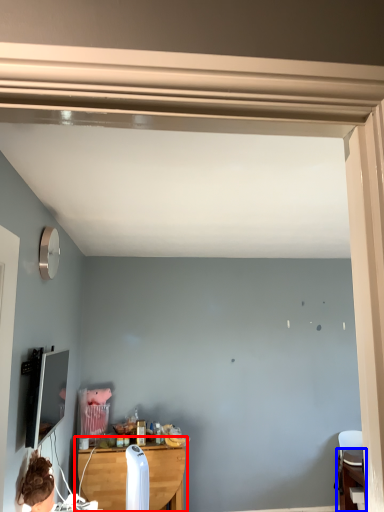
Question: Which object appears farthest to the camera in this image, table (highlighted by a red box) or table (highlighted by a blue box)?

Choices:
 (A) table
 (B) table

Answer: (B)